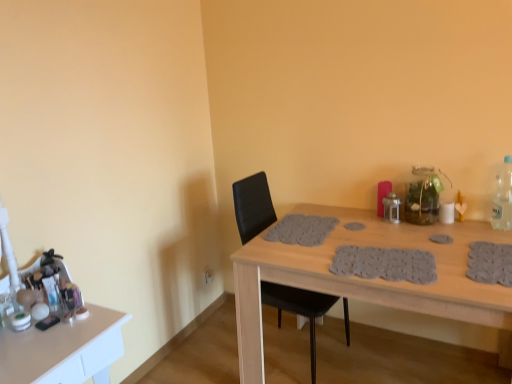
Question: From the image's perspective, is wooden table at center, the second table positioned from the left, over white glossy makeup at left, the 1th table in the left-to-right sequence?

Choices:
 (A) yes
 (B) no

Answer: (A)

Question: From a real-world perspective, does wooden table at center, the second table positioned from the left, sit lower than white glossy makeup at left, arranged as the second table when viewed from the right?

Choices:
 (A) no
 (B) yes

Answer: (B)

Question: Could white glossy makeup at left, arranged as the second table when viewed from the right, be considered to be inside wooden table at center, the first table positioned from the right?

Choices:
 (A) yes
 (B) no

Answer: (B)

Question: Is wooden table at center, the first table positioned from the right, at the right side of white glossy makeup at left, the 1th table in the left-to-right sequence?

Choices:
 (A) yes
 (B) no

Answer: (A)

Question: Is white glossy makeup at left, arranged as the second table when viewed from the right, at the back of wooden table at center, the first table positioned from the right?

Choices:
 (A) no
 (B) yes

Answer: (A)

Question: From the image's perspective, relative to clear plastic bottle at right, is white glossy makeup at left, arranged as the second table when viewed from the right, above or below?

Choices:
 (A) below
 (B) above

Answer: (A)

Question: Is white glossy makeup at left, arranged as the second table when viewed from the right, in front of or behind clear plastic bottle at right in the image?

Choices:
 (A) behind
 (B) front

Answer: (B)

Question: In terms of height, does white glossy makeup at left, the 1th table in the left-to-right sequence, look taller or shorter compared to clear plastic bottle at right?

Choices:
 (A) short
 (B) tall

Answer: (B)

Question: From a real-world perspective, relative to clear plastic bottle at right, is white glossy makeup at left, the 1th table in the left-to-right sequence, vertically above or below?

Choices:
 (A) below
 (B) above

Answer: (A)

Question: Considering the positions of wooden table at center, the second table positioned from the left, and black leather chair at center in the image, is wooden table at center, the second table positioned from the left, taller or shorter than black leather chair at center?

Choices:
 (A) tall
 (B) short

Answer: (B)

Question: Considering the positions of point (397, 292) and point (247, 236), is point (397, 292) closer or farther from the camera than point (247, 236)?

Choices:
 (A) farther
 (B) closer

Answer: (B)

Question: Based on their sizes in the image, would you say wooden table at center, the first table positioned from the right, is bigger or smaller than black leather chair at center?

Choices:
 (A) big
 (B) small

Answer: (A)

Question: From a real-world perspective, relative to black leather chair at center, is wooden table at center, the first table positioned from the right, vertically above or below?

Choices:
 (A) above
 (B) below

Answer: (B)

Question: Is white glossy makeup at left, arranged as the second table when viewed from the right, in front of or behind black leather chair at center in the image?

Choices:
 (A) front
 (B) behind

Answer: (A)

Question: Visually, is white glossy makeup at left, arranged as the second table when viewed from the right, positioned to the left or to the right of black leather chair at center?

Choices:
 (A) right
 (B) left

Answer: (B)